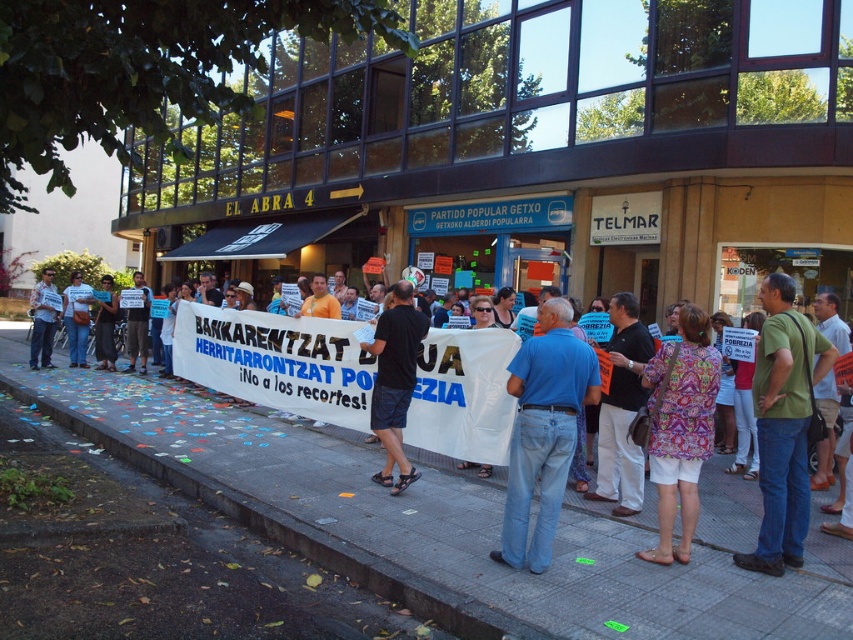
You are a photographer trying to capture the protest scene. You want to ensure the gray concrete pavement at lower center and the green cotton shirt at center are both visible in your shot. Given their relative heights, what adjustment should you make to your camera angle?

Since the gray concrete pavement at lower center is not as tall as the green cotton shirt at center, you should lower your camera angle to ensure both are visible in the frame.

You are a photographer standing at the entrance of the building. You want to take a photo of the gray concrete pavement at lower center and the green cotton shirt at center. Can you fit both in the frame of your camera which has a 2.5 meter wide field of view?

The gray concrete pavement at lower center and the green cotton shirt at center are 2.31 meters apart. Since the distance between them is less than the camera field of view of 2.5 meters, both can be captured in a single frame.

You are a photographer at the protest scene. You need to capture a photo that includes both the paisley fabric shirt at center and the matte black shirt at left. Based on their positions, which shirt should you focus on first to ensure both are in frame?

The paisley fabric shirt at center is located below the matte black shirt at left. To include both in the frame, focus on the matte black shirt at left first, as it is higher up, then adjust the camera angle downward to include the paisley fabric shirt at center.